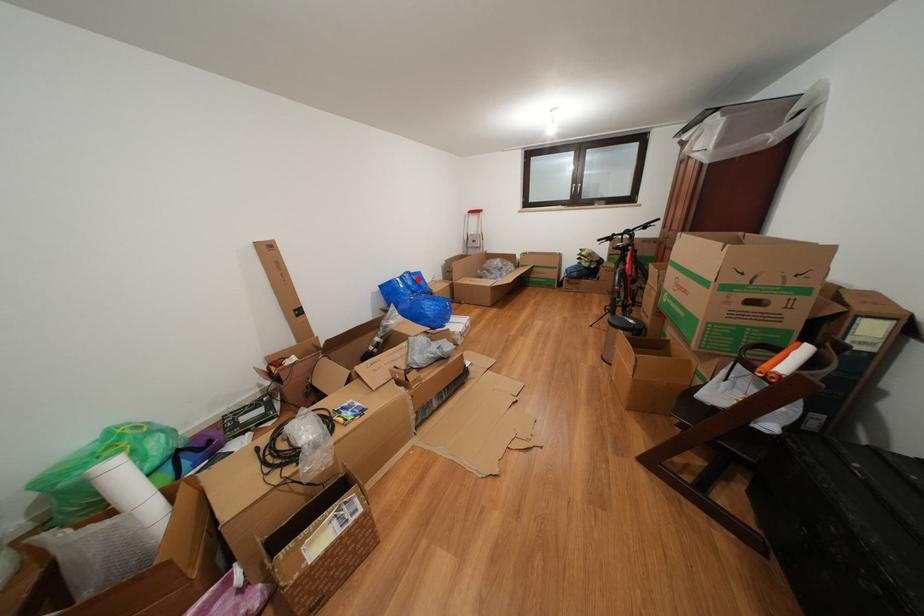
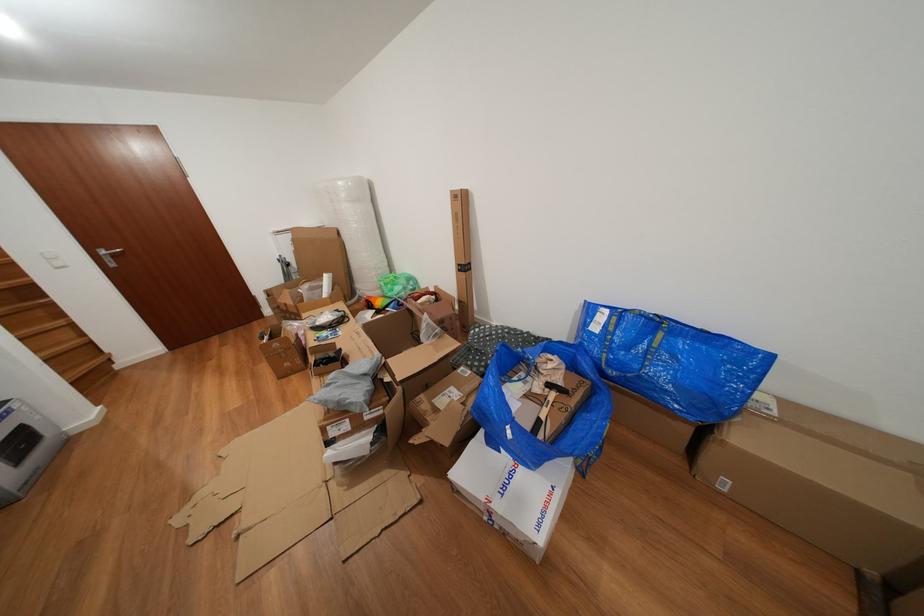
Question: I am providing you with two images of the same scene from different viewpoints. In image1, a red point is highlighted. Considering the same 3D point in image2, which of the following is correct?

Choices:
 (A) It is closer
 (B) It is farther

Answer: (B)